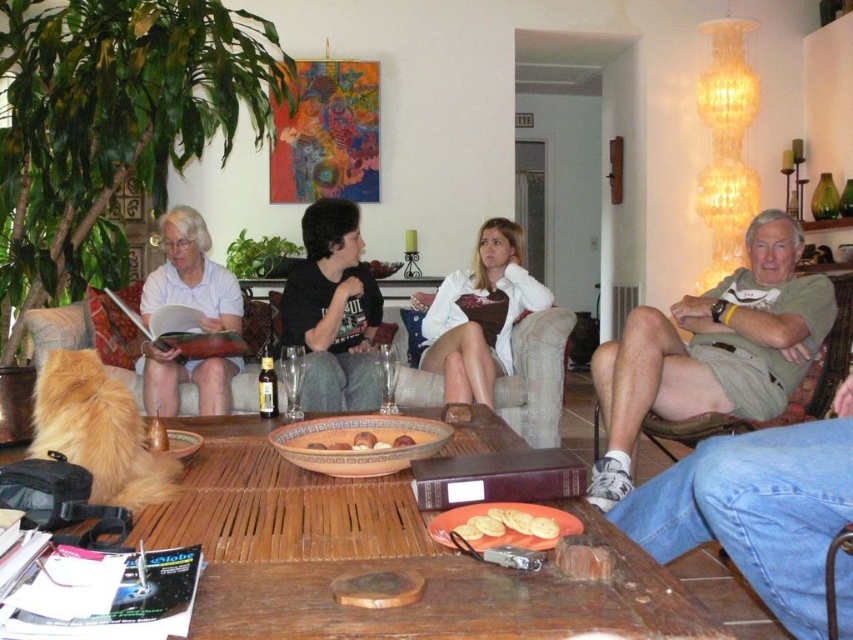
Question: Which of these objects is positioned closest to the brown fabric couch at center?

Choices:
 (A) white matte shirt at center
 (B) khaki cotton shorts at right

Answer: (A)

Question: Which of these objects is positioned farthest from the black cotton shirt at center?

Choices:
 (A) white matte shirt at left
 (B) white matte shirt at center
 (C) golden crispy bread at center
 (D) smooth brown cookie at center

Answer: (C)

Question: Which object appears farthest from the camera in this image?

Choices:
 (A) brown matte bowl at center
 (B) khaki cotton shorts at right
 (C) golden crispy cookies at center

Answer: (B)

Question: Is black cotton shirt at center above white matte shirt at center?

Choices:
 (A) yes
 (B) no

Answer: (A)

Question: From the image, what is the correct spatial relationship of wooden table at center in relation to white matte shirt at center?

Choices:
 (A) above
 (B) below

Answer: (B)

Question: Can you confirm if black cotton shirt at center is smaller than white matte shirt at center?

Choices:
 (A) no
 (B) yes

Answer: (A)